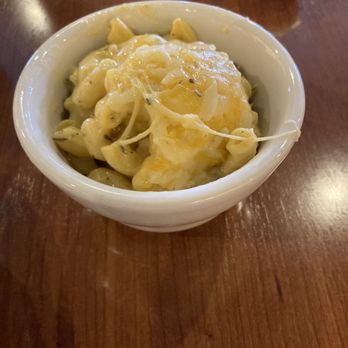
In order to click on tabletop in this screenshot , I will do `click(176, 278)`.